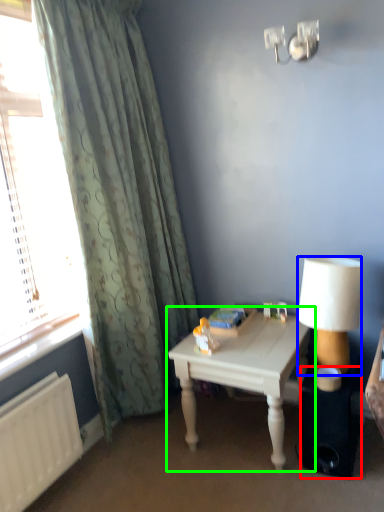
Question: Considering the real-world distances, which object is farthest from loudspeaker (highlighted by a red box)? lamp (highlighted by a blue box) or table (highlighted by a green box)?

Choices:
 (A) lamp
 (B) table

Answer: (B)